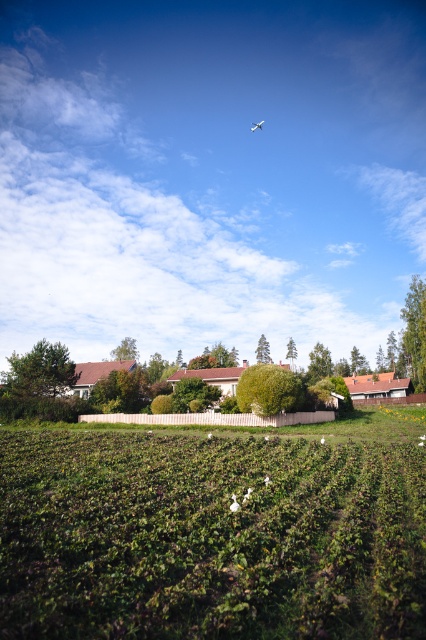
Can you confirm if green leafy field at center is positioned above white matte airplane at upper center?

No.

At what (x,y) coordinates should I click in order to perform the action: click on green leafy field at center. Please return your answer as a coordinate pair (x, y). Looking at the image, I should click on (210, 538).

Which is behind, point (281, 596) or point (253, 129)?

The point (253, 129) is more distant.

This screenshot has width=426, height=640. I want to click on green leafy field at center, so click(210, 538).

Does point (259, 406) lie behind point (256, 129)?

No, (259, 406) is closer to viewer.

Can you confirm if green leafy hedge at center is positioned to the left of white matte airplane at upper center?

Correct, you'll find green leafy hedge at center to the left of white matte airplane at upper center.

Is point (284, 380) positioned before point (261, 120)?

Yes, point (284, 380) is closer to viewer.

Where is `green leafy hedge at center`? green leafy hedge at center is located at coordinates (268, 388).

Can you confirm if green leafy field at center is shorter than green leafy hedge at center?

Incorrect, green leafy field at center's height does not fall short of green leafy hedge at center's.

Which is in front, point (416, 484) or point (282, 410)?

Point (416, 484) is in front.

Identify the location of green leafy field at center. This screenshot has height=640, width=426. (210, 538).